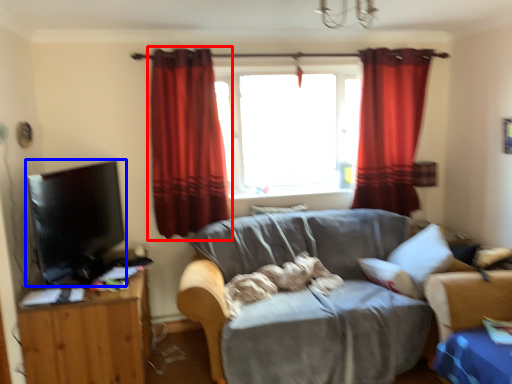
Question: Which object is closer to the camera taking this photo, curtain (highlighted by a red box) or flat (highlighted by a blue box)?

Choices:
 (A) curtain
 (B) flat

Answer: (B)